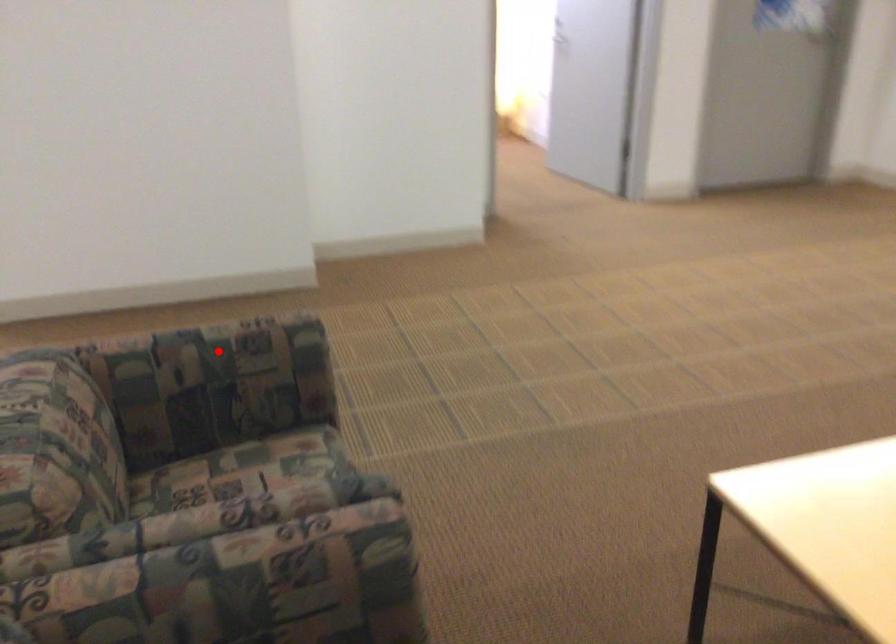
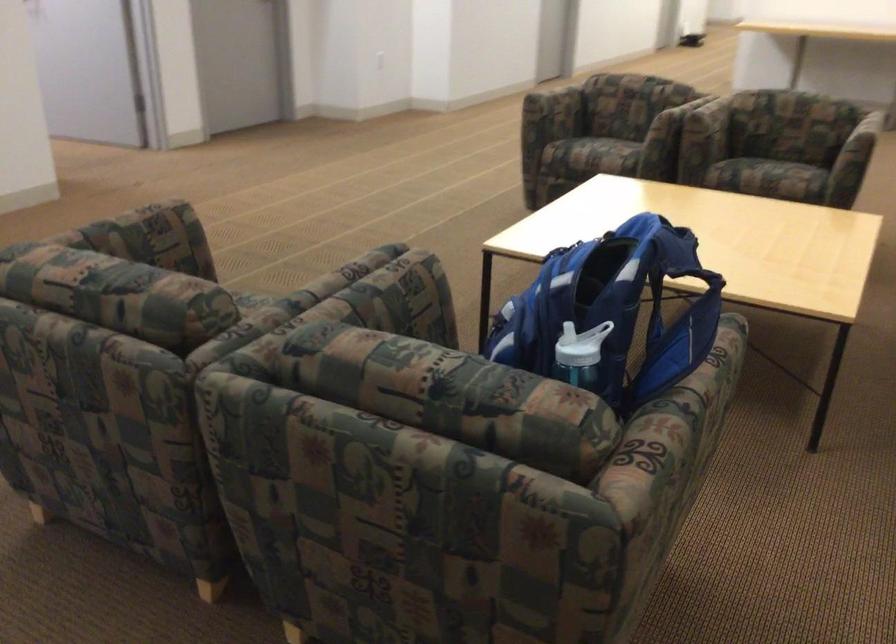
Question: I am providing you with two images of the same scene from different viewpoints. A red point is shown in image1. For the corresponding object point in image2, is it positioned nearer or farther from the camera?

Choices:
 (A) Nearer
 (B) Farther

Answer: (B)